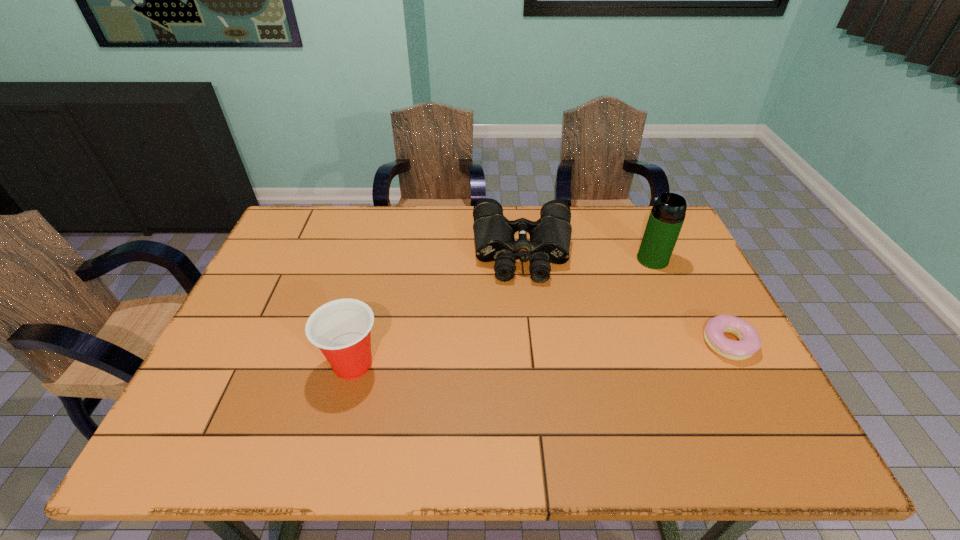
In the image, there is a desktop. Where is `free space at the far edge`? The image size is (960, 540). free space at the far edge is located at coordinates (366, 236).

The height and width of the screenshot is (540, 960). I want to click on vacant space at the near edge, so click(367, 386).

Image resolution: width=960 pixels, height=540 pixels. In order to click on free point at the left edge in this screenshot , I will do `click(318, 251)`.

Where is `vacant space at the right edge of the desktop`? The width and height of the screenshot is (960, 540). vacant space at the right edge of the desktop is located at coordinates [x=720, y=375].

I want to click on vacant area at the near left corner, so click(x=201, y=390).

Locate an element on the screen. The width and height of the screenshot is (960, 540). unoccupied area between the thermos bottle and the third object from right to left is located at coordinates (x=588, y=255).

You are a GUI agent. You are given a task and a screenshot of the screen. Output one action in this format:
    pyautogui.click(x=<x>, y=<y>)
    Task: Click on the unoccupied position between the tallest object and the third object from right to left
    
    Given the screenshot: What is the action you would take?
    pyautogui.click(x=588, y=255)

Where is `free spot between the doughnut and the third shortest object`? This screenshot has height=540, width=960. free spot between the doughnut and the third shortest object is located at coordinates pyautogui.click(x=540, y=354).

Identify the location of blank region between the binoculars and the tallest object. point(588,255).

Identify the location of blank region between the cup and the second object from left to right. The width and height of the screenshot is (960, 540). click(438, 308).